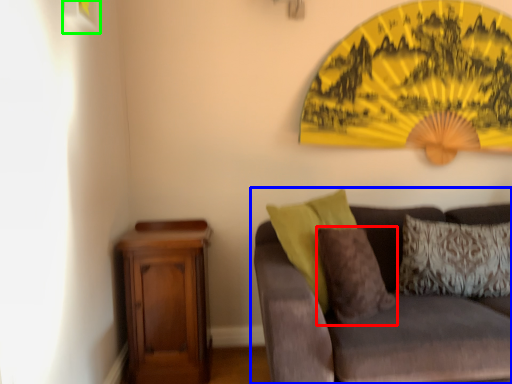
Question: Estimate the real-world distances between objects in this image. Which object is closer to pillow (highlighted by a red box), studio couch (highlighted by a blue box) or picture frame (highlighted by a green box)?

Choices:
 (A) studio couch
 (B) picture frame

Answer: (A)